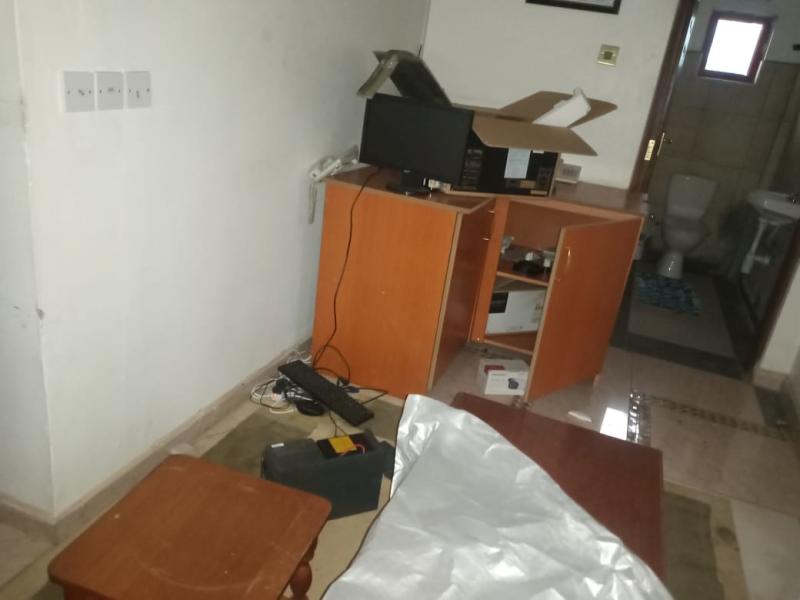
The image size is (800, 600). I want to click on sink, so click(x=764, y=205).